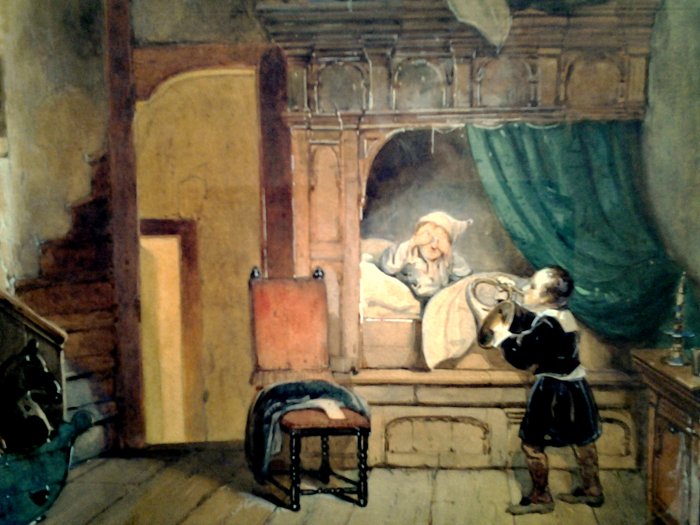
At what (x,y) coordinates should I click in order to perform the action: click on seat of chair. Please return your answer as a coordinate pair (x, y). This screenshot has width=700, height=525. Looking at the image, I should click on (306, 413).